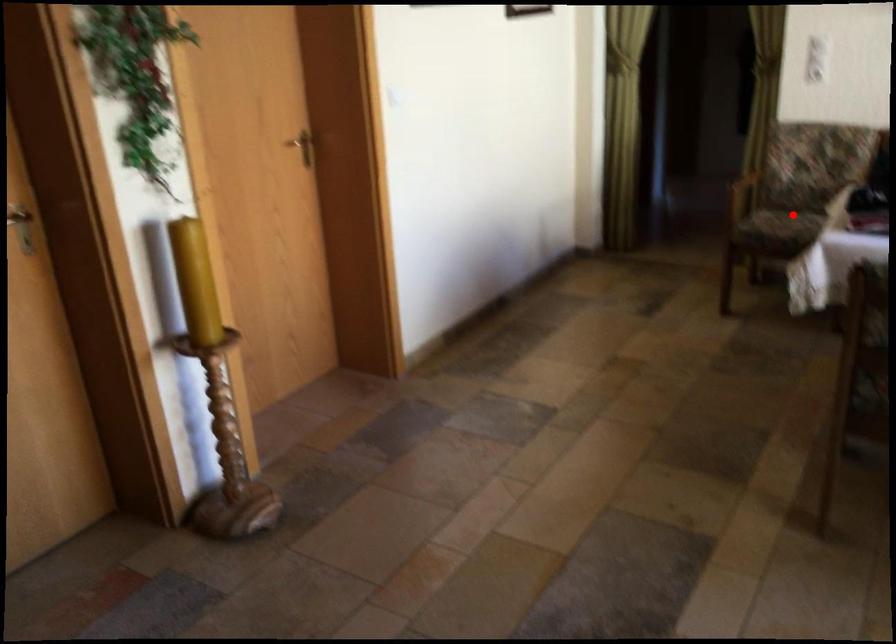
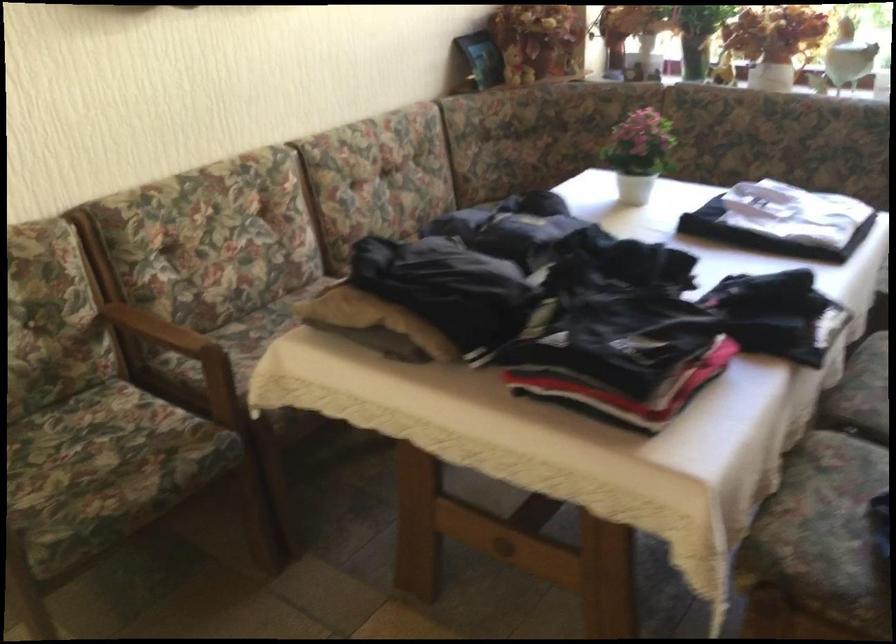
Find the pixel in the second image that matches the highlighted location in the first image.

(67, 444)